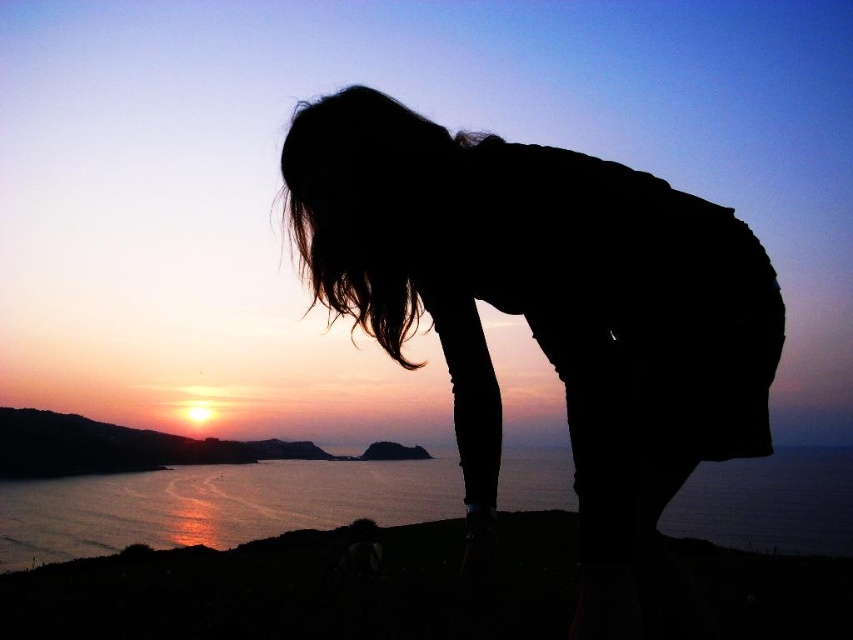
Question: Is silhouette figure at center closer to camera compared to glistening water at lower left?

Choices:
 (A) yes
 (B) no

Answer: (A)

Question: In this image, where is silhouette figure at center located relative to glistening water at lower left?

Choices:
 (A) below
 (B) above

Answer: (B)

Question: Where is silhouette figure at center located in relation to glistening water at lower left in the image?

Choices:
 (A) right
 (B) left

Answer: (B)